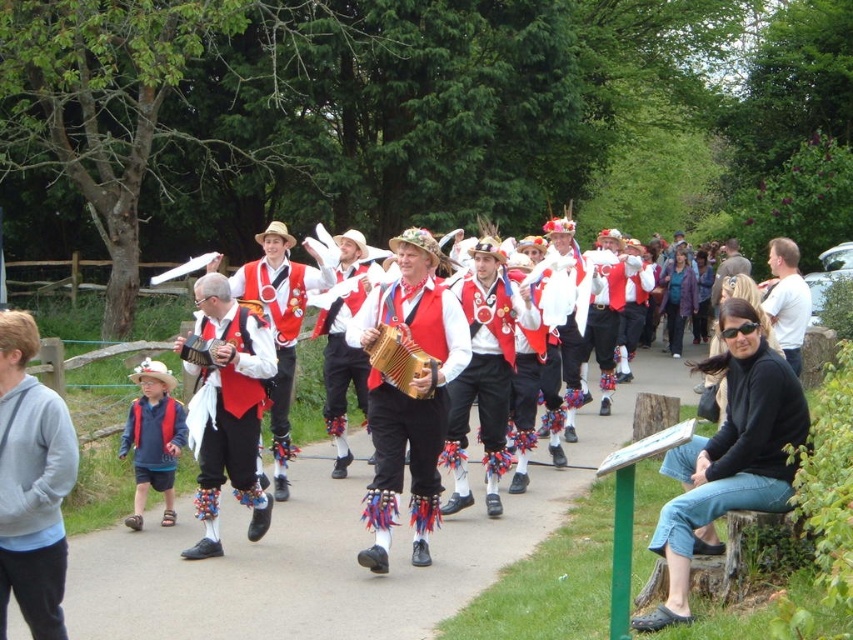
Can you confirm if blue denim shorts at left is taller than matte wooden accordion at center?

Yes, blue denim shorts at left is taller than matte wooden accordion at center.

Based on the photo, who is lower down, blue denim shorts at left or matte wooden accordion at center?

Positioned lower is blue denim shorts at left.

Does point (178, 426) lie in front of point (195, 364)?

No.

Where is `blue denim shorts at left`? The image size is (853, 640). blue denim shorts at left is located at coordinates (154, 438).

Locate an element on the screen. The height and width of the screenshot is (640, 853). black matte jacket at lower right is located at coordinates tap(729, 456).

At what (x,y) coordinates should I click in order to perform the action: click on black matte jacket at lower right. Please return your answer as a coordinate pair (x, y). Looking at the image, I should click on (729, 456).

Is gold wooden accordion at center below matte wooden accordion at center?

Yes, gold wooden accordion at center is below matte wooden accordion at center.

Is point (405, 330) behind point (228, 353)?

No.

I want to click on gold wooden accordion at center, so click(402, 362).